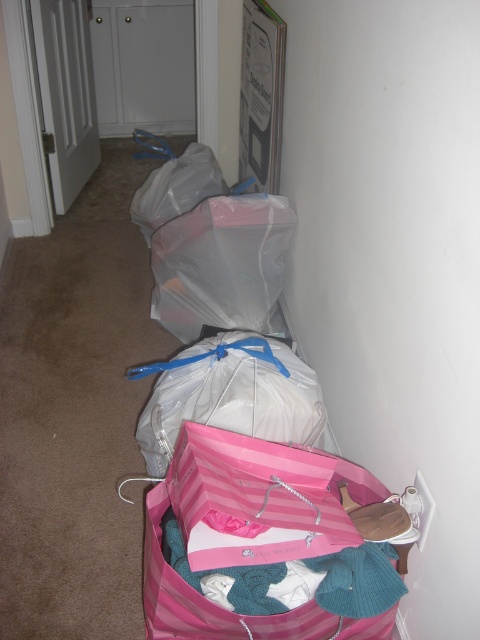
Question: Is pink striped paper bag at lower center wider than transparent plastic bag at center?

Choices:
 (A) no
 (B) yes

Answer: (A)

Question: Which object is positioned farthest from the pink striped paper bag at lower center?

Choices:
 (A) transparent plastic bag at center
 (B) clear plastic bag at center

Answer: (A)

Question: Is clear plastic bag at center wider than transparent plastic bag at center?

Choices:
 (A) yes
 (B) no

Answer: (B)

Question: Which of these objects is positioned closest to the pink striped paper bag at lower center?

Choices:
 (A) clear plastic bag at center
 (B) transparent plastic bag at center

Answer: (A)

Question: Does pink striped paper bag at lower center appear on the left side of clear plastic bag at center?

Choices:
 (A) yes
 (B) no

Answer: (B)

Question: Which of the following is the closest to the observer?

Choices:
 (A) transparent plastic bag at center
 (B) pink striped paper bag at lower center

Answer: (B)